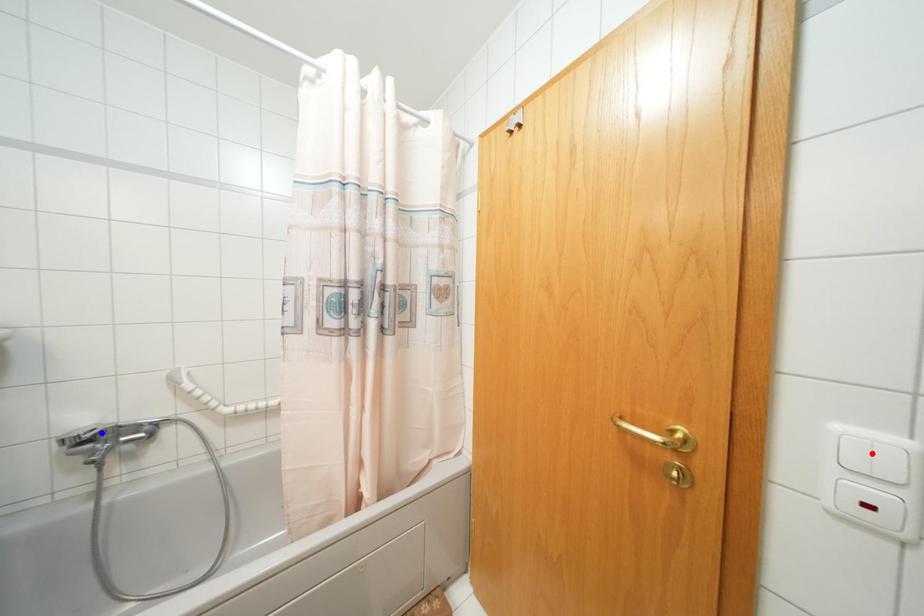
Question: Two points are marked on the image. Which point is closer to the camera?

Choices:
 (A) Blue point is closer.
 (B) Red point is closer.

Answer: (B)